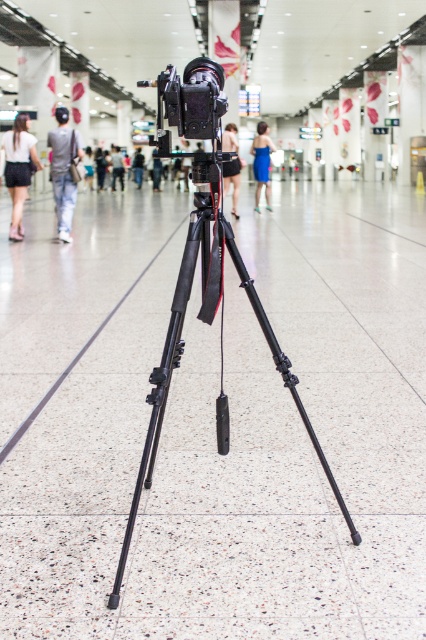
Is black matte video camera at center wider than denim pants at left?

No.

Does black matte video camera at center appear on the right side of denim pants at left?

Yes, black matte video camera at center is to the right of denim pants at left.

Measure the distance between black matte video camera at center and camera.

The distance of black matte video camera at center from camera is 1.65 meters.

Identify the location of black matte video camera at center. This screenshot has height=640, width=426. (189, 100).

Can you confirm if black matte video camera at center is thinner than black fabric person at center?

Correct, black matte video camera at center's width is less than black fabric person at center's.

Is point (210, 86) farther from camera compared to point (135, 166)?

No.

Which is in front, point (199, 76) or point (141, 173)?

Point (199, 76)

The height and width of the screenshot is (640, 426). Identify the location of black matte video camera at center. (189, 100).

Is black matte video camera at center below matte black camera at center?

Indeed, black matte video camera at center is positioned under matte black camera at center.

Describe the element at coordinates (189, 100) in the screenshot. The height and width of the screenshot is (640, 426). I see `black matte video camera at center` at that location.

The height and width of the screenshot is (640, 426). What are the coordinates of `black matte video camera at center` in the screenshot? It's located at (x=189, y=100).